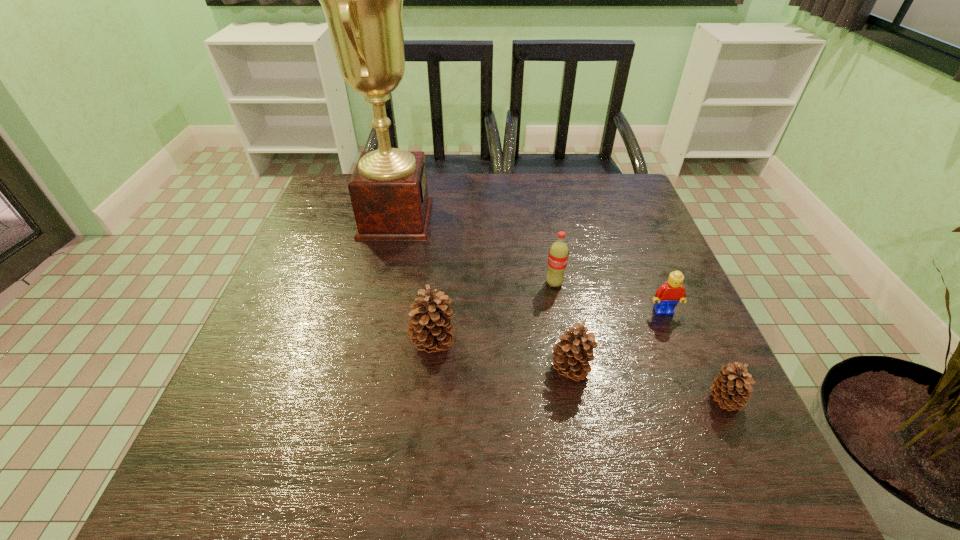
This screenshot has height=540, width=960. In order to click on free space that satisfies the following two spatial constraints: 1. on the plaque of the tallest object; 2. on the back side of the second pinecone from right to left in this screenshot , I will do `click(360, 370)`.

Find the location of a particular element. free spot that satisfies the following two spatial constraints: 1. on the plaque of the farthest object; 2. on the right side of the second pinecone from left to right is located at coordinates (360, 370).

What are the coordinates of `free space in the image that satisfies the following two spatial constraints: 1. on the plaque of the farthest object; 2. on the left side of the second shortest pinecone` in the screenshot? It's located at (360, 370).

At what (x,y) coordinates should I click in order to perform the action: click on blank space that satisfies the following two spatial constraints: 1. on the plaque of the tallest object; 2. on the left side of the second farthest object. Please return your answer as a coordinate pair (x, y). Looking at the image, I should click on (381, 284).

This screenshot has height=540, width=960. Find the location of `vacant space that satisfies the following two spatial constraints: 1. on the back side of the tallest pinecone; 2. on the plaque of the tallest object`. vacant space that satisfies the following two spatial constraints: 1. on the back side of the tallest pinecone; 2. on the plaque of the tallest object is located at coordinates (444, 219).